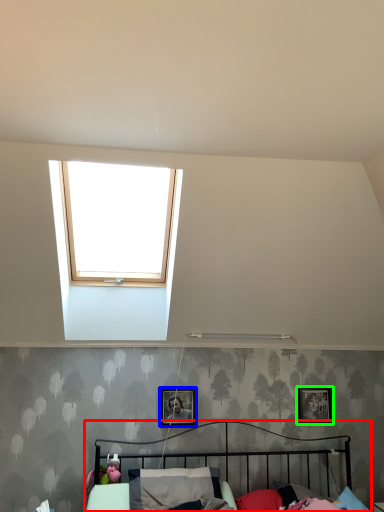
Question: Which object is the closest to the bed (highlighted by a red box)? Choose among these: picture frame (highlighted by a blue box) or picture frame (highlighted by a green box).

Choices:
 (A) picture frame
 (B) picture frame

Answer: (A)